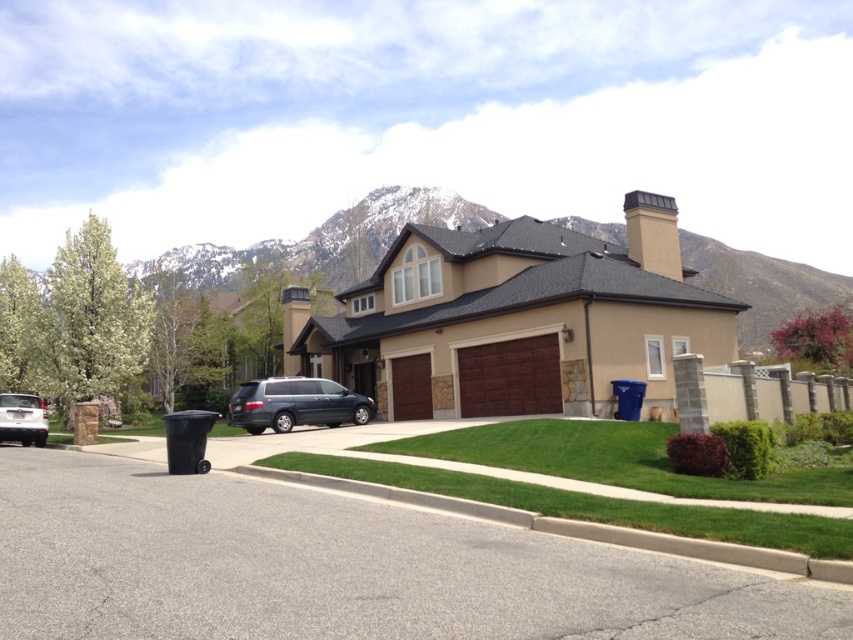
Which is in front, point (349, 390) or point (41, 442)?

Positioned in front is point (41, 442).

This screenshot has height=640, width=853. In order to click on satin dark blue minivan at center in this screenshot , I will do `click(294, 404)`.

Based on the photo, is snowy rock at upper center wider than white matte van at lower left?

Yes, snowy rock at upper center is wider than white matte van at lower left.

Between snowy rock at upper center and white matte van at lower left, which one has more height?

snowy rock at upper center

The width and height of the screenshot is (853, 640). Describe the element at coordinates (328, 240) in the screenshot. I see `snowy rock at upper center` at that location.

Where is `snowy rock at upper center`? snowy rock at upper center is located at coordinates (328, 240).

Who is shorter, brown wood/glass garage at center or satin dark blue minivan at center?

Standing shorter between the two is satin dark blue minivan at center.

Does point (451, 252) come in front of point (267, 416)?

That is False.

At what (x,y) coordinates should I click in order to perform the action: click on brown wood/glass garage at center. Please return your answer as a coordinate pair (x, y). This screenshot has height=640, width=853. Looking at the image, I should click on (517, 320).

Locate an element on the screen. brown wood/glass garage at center is located at coordinates (517, 320).